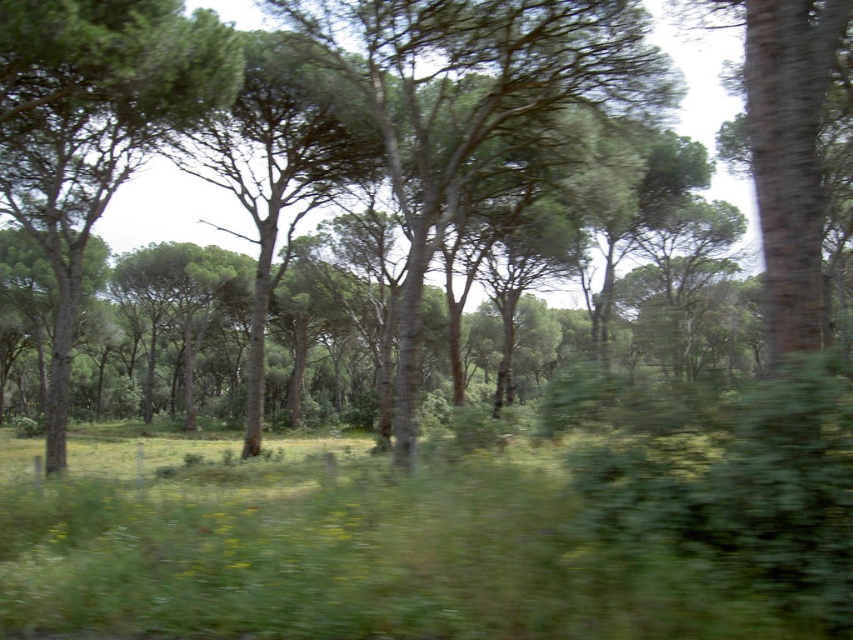
Question: Is green leafy grass at center positioned before green rough bark tree at left?

Choices:
 (A) yes
 (B) no

Answer: (A)

Question: In this image, where is green leafy grass at center located relative to green rough bark tree at left?

Choices:
 (A) above
 (B) below

Answer: (B)

Question: Does green leafy tree at center lie in front of green rough bark tree at left?

Choices:
 (A) yes
 (B) no

Answer: (B)

Question: Among these points, which one is farthest from the camera?

Choices:
 (A) (505, 548)
 (B) (24, 166)

Answer: (B)

Question: Which of the following is the closest to the observer?

Choices:
 (A) (642, 68)
 (B) (239, 49)

Answer: (B)

Question: Estimate the real-world distances between objects in this image. Which object is farther from the green leafy tree at center?

Choices:
 (A) green rough bark tree at left
 (B) green leafy grass at center

Answer: (B)